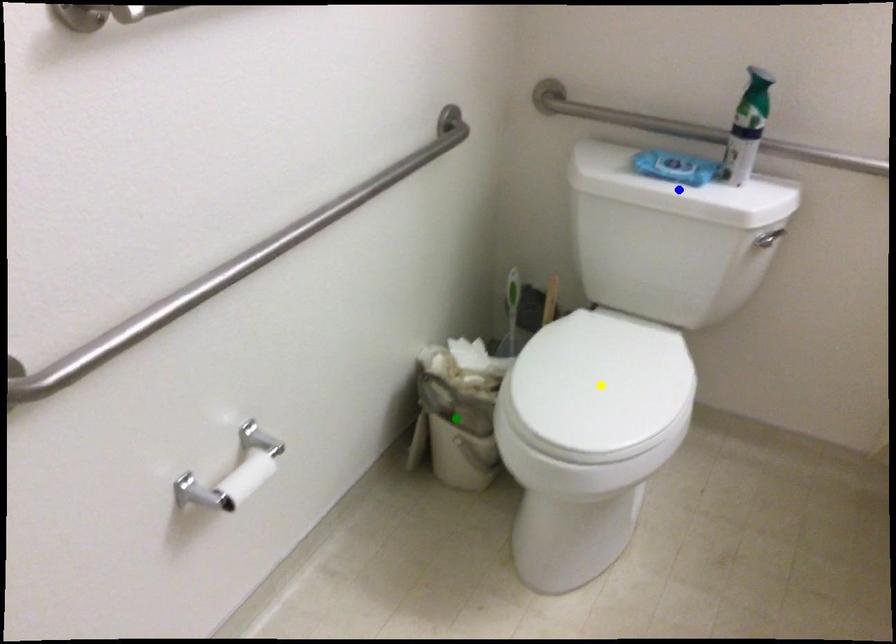
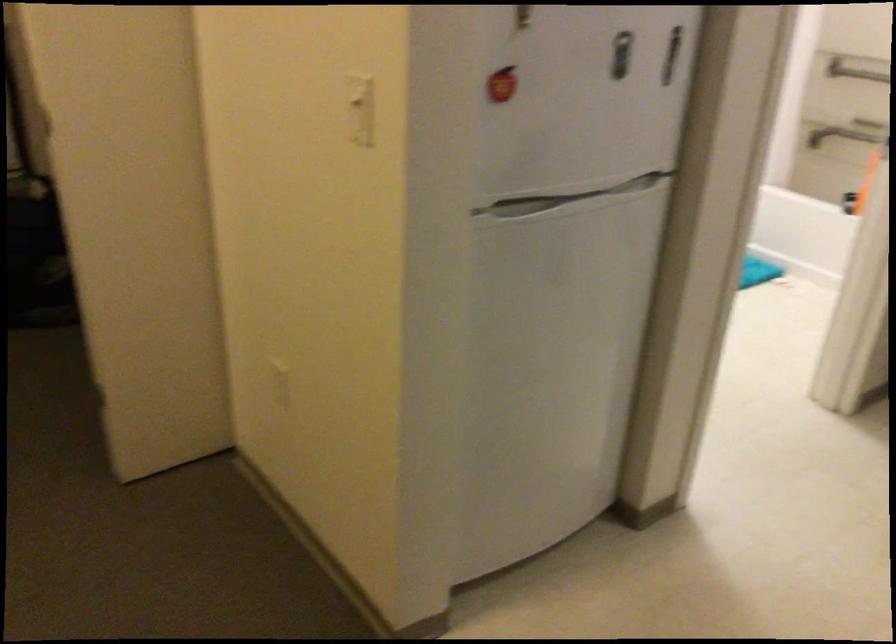
I am providing you with two images of the same scene from different viewpoints. Three points are marked in image1. Which point corresponds to a part or object that is occluded in image2?In image1, three points are marked. Which of them correspond to a part or object that is occluded in image2?Among the three points shown in image1, which one corresponds to a part or object that is no longer visible due to occlusion in image2?

blue point, yellow point, green point cannot be seen in image2.